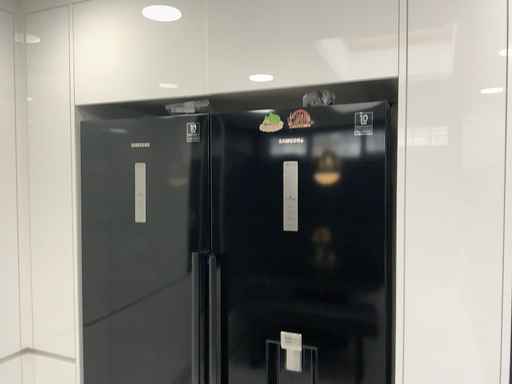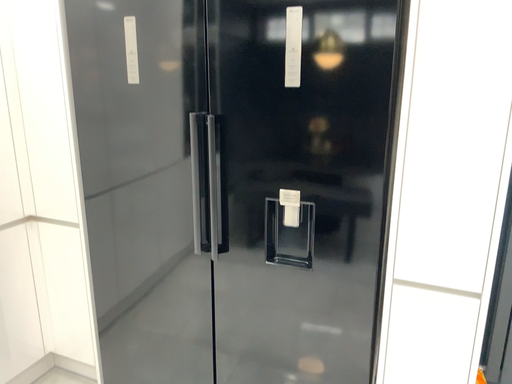
Question: Which way did the camera rotate in the video?

Choices:
 (A) rotated downward
 (B) rotated upward

Answer: (A)